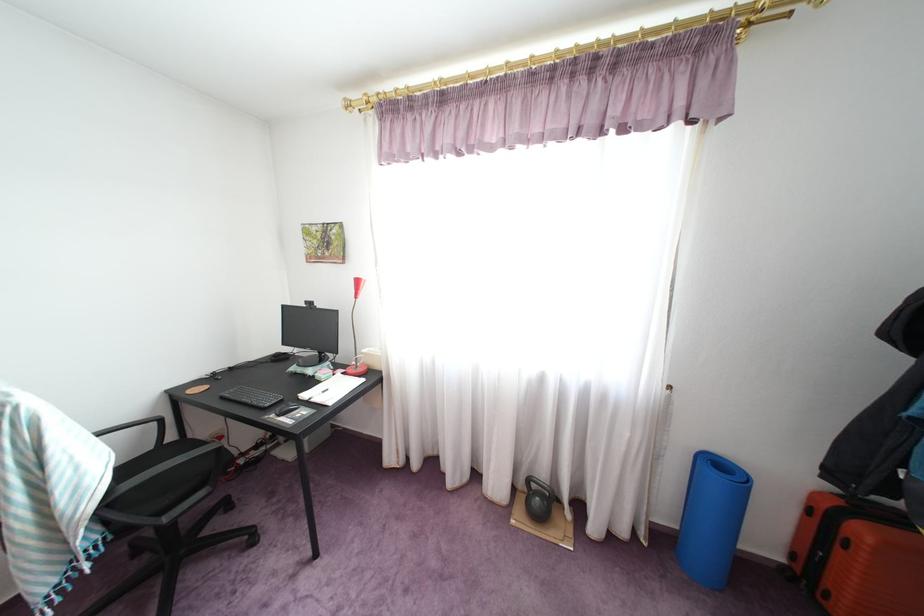
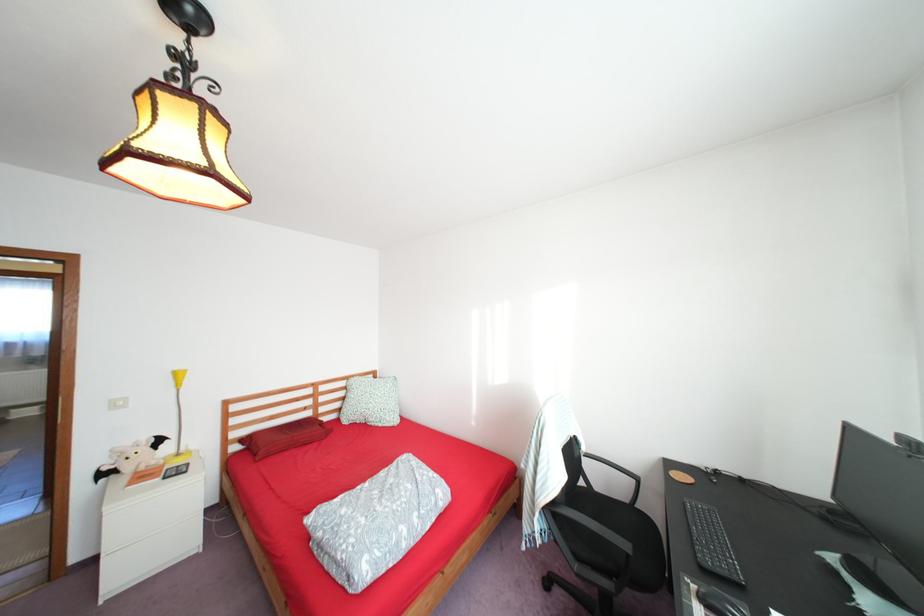
Find the pixel in the second image that matches the point at 283,415 in the first image.

(706, 586)